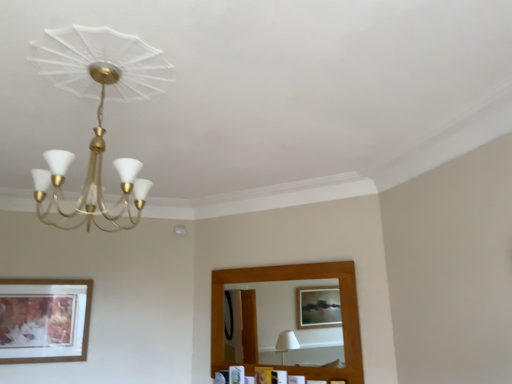
Question: Should I look upward or downward to see matte gold chandelier at upper left?

Choices:
 (A) up
 (B) down

Answer: (A)

Question: Can you confirm if matte gold chandelier at upper left is smaller than wooden picture frame at lower center, marked as the first picture frame in a right-to-left arrangement?

Choices:
 (A) yes
 (B) no

Answer: (B)

Question: From a real-world perspective, is matte gold chandelier at upper left physically above wooden picture frame at lower center, acting as the third picture frame starting from the left?

Choices:
 (A) yes
 (B) no

Answer: (A)

Question: Considering the relative sizes of matte gold chandelier at upper left and wooden picture frame at lower center, acting as the third picture frame starting from the left, in the image provided, is matte gold chandelier at upper left shorter than wooden picture frame at lower center, acting as the third picture frame starting from the left,?

Choices:
 (A) no
 (B) yes

Answer: (A)

Question: Is matte gold chandelier at upper left to the right of wooden picture frame at lower center, marked as the first picture frame in a right-to-left arrangement, from the viewer's perspective?

Choices:
 (A) yes
 (B) no

Answer: (B)

Question: Is matte gold chandelier at upper left positioned with its back to wooden picture frame at lower center, marked as the first picture frame in a right-to-left arrangement?

Choices:
 (A) no
 (B) yes

Answer: (A)

Question: Is matte gold chandelier at upper left facing towards wooden picture frame at lower center, marked as the first picture frame in a right-to-left arrangement?

Choices:
 (A) no
 (B) yes

Answer: (A)

Question: Can you confirm if wooden picture frame at lower center, marked as the first picture frame in a right-to-left arrangement, is shorter than matte gold chandelier at upper left?

Choices:
 (A) yes
 (B) no

Answer: (A)

Question: From the image's perspective, does wooden picture frame at lower center, marked as the first picture frame in a right-to-left arrangement, appear lower than matte gold chandelier at upper left?

Choices:
 (A) yes
 (B) no

Answer: (A)

Question: Does wooden picture frame at lower center, marked as the first picture frame in a right-to-left arrangement, have a greater height compared to matte gold chandelier at upper left?

Choices:
 (A) no
 (B) yes

Answer: (A)

Question: Is wooden picture frame at lower center, marked as the first picture frame in a right-to-left arrangement, positioned before matte gold chandelier at upper left?

Choices:
 (A) no
 (B) yes

Answer: (A)

Question: Can you confirm if wooden picture frame at lower center, marked as the first picture frame in a right-to-left arrangement, is thinner than matte gold chandelier at upper left?

Choices:
 (A) no
 (B) yes

Answer: (B)

Question: Is wooden picture frame at lower center, marked as the first picture frame in a right-to-left arrangement, outside of matte gold chandelier at upper left?

Choices:
 (A) yes
 (B) no

Answer: (A)

Question: Is wooden picture frame at lower left, the 3th picture frame from the right, touching wooden picture frame at lower center, marked as the first picture frame in a right-to-left arrangement?

Choices:
 (A) no
 (B) yes

Answer: (A)